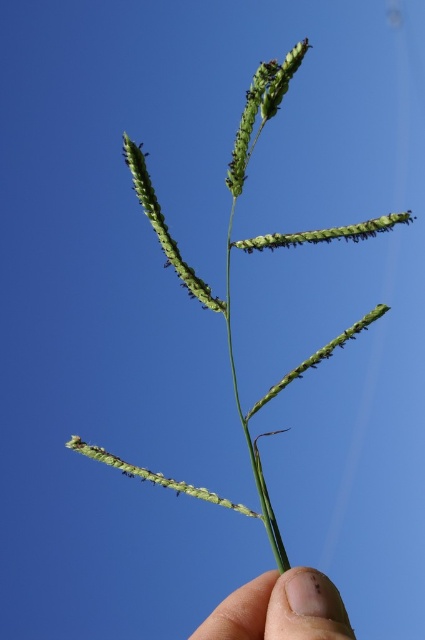
Is green matte grass at center positioned before flesh/soft skin at lower center?

That is False.

Between green matte grass at center and flesh/soft skin at lower center, which one has less height?

Standing shorter between the two is flesh/soft skin at lower center.

Which is behind, point (181, 264) or point (334, 600)?

Positioned behind is point (181, 264).

Image resolution: width=425 pixels, height=640 pixels. Find the location of `green matte grass at center`. green matte grass at center is located at coordinates (229, 280).